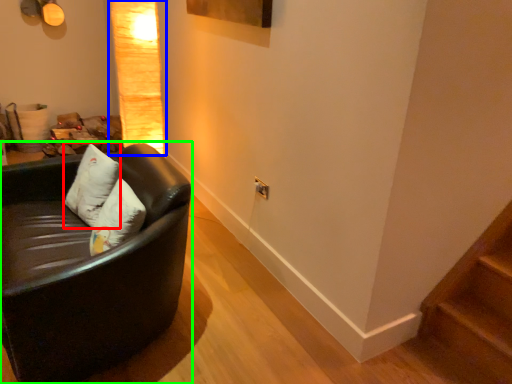
Question: Considering the real-world distances, which object is closest to pillow (highlighted by a red box)? lamp (highlighted by a blue box) or studio couch (highlighted by a green box).

Choices:
 (A) lamp
 (B) studio couch

Answer: (B)